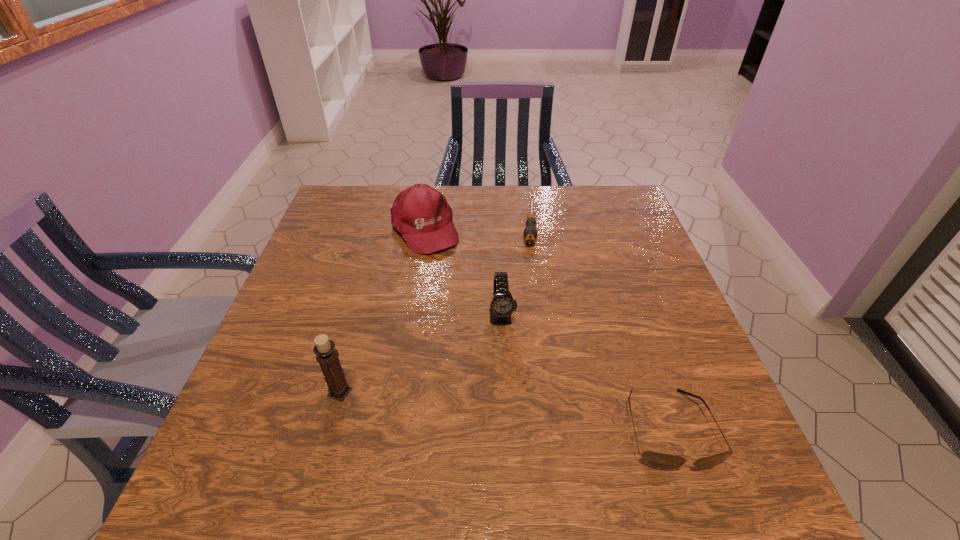
Find the location of `the tallest object`. the tallest object is located at coordinates (326, 354).

At what (x,y) coordinates should I click in order to perform the action: click on sunglasses. Please return your answer as a coordinate pair (x, y). This screenshot has width=960, height=540. Looking at the image, I should click on (662, 461).

Locate an element on the screen. The image size is (960, 540). the fourth tallest object is located at coordinates (662, 461).

The width and height of the screenshot is (960, 540). In order to click on screwdriver in this screenshot , I will do `click(530, 233)`.

Locate an element on the screen. the shortest object is located at coordinates (530, 233).

You are a GUI agent. You are given a task and a screenshot of the screen. Output one action in this format:
    pyautogui.click(x=<x>, y=<y>)
    Task: Click on the baseball cap
    The height and width of the screenshot is (540, 960).
    Given the screenshot: What is the action you would take?
    pyautogui.click(x=421, y=214)

I want to click on watch, so click(502, 306).

At what (x,y) coordinates should I click in order to perform the action: click on the third object from left to right. Please return your answer as a coordinate pair (x, y). The width and height of the screenshot is (960, 540). Looking at the image, I should click on (502, 306).

The height and width of the screenshot is (540, 960). Identify the location of free location located 0.390m on the back of the candle holder. (376, 260).

Locate an element on the screen. The width and height of the screenshot is (960, 540). vacant space located 0.270m at the tip of the fourth object from left to right is located at coordinates (528, 321).